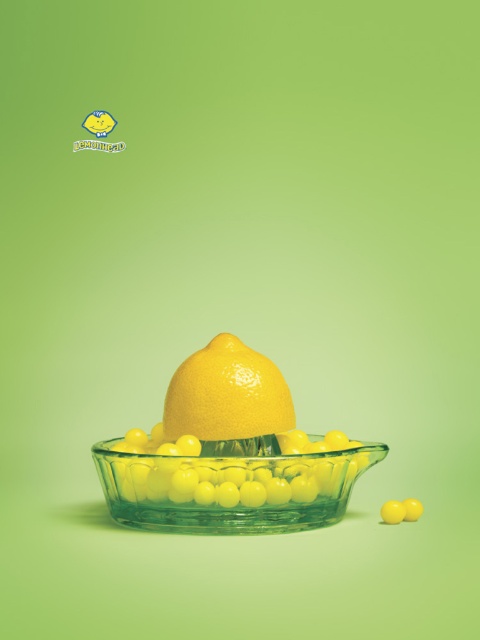
You are planning to place a small toy inside the transparent glass bowl at center and the glossy citrus fruit at center. Which object has a larger width to accommodate the toy?

The transparent glass bowl at center has a larger width than the glossy citrus fruit at center, so it can accommodate the toy better.

You are trying to place a small toy boat in the transparent glass bowl at center. However, there is a glossy citrus fruit at center in the way. Can you still fit the boat into the bowl?

The transparent glass bowl at center is positioned under the glossy citrus fruit at center, meaning the fruit is resting on top of the bowl. This would leave space below the fruit for the boat to fit inside the bowl.

You are an artist trying to paint this scene. If you want to paint the glossy citrus fruit at center first, should you paint the transparent glass bowl at center before or after?

The transparent glass bowl at center is in front of the glossy citrus fruit at center, so you should paint the glossy citrus fruit at center first and then paint the transparent glass bowl at center on top of it.